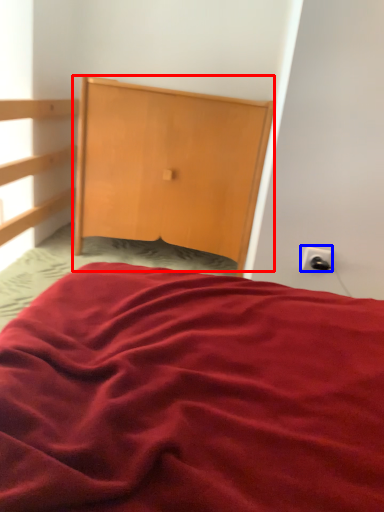
Question: Which of the following is the farthest to the observer, dresser (highlighted by a red box) or electric outlet (highlighted by a blue box)?

Choices:
 (A) dresser
 (B) electric outlet

Answer: (A)